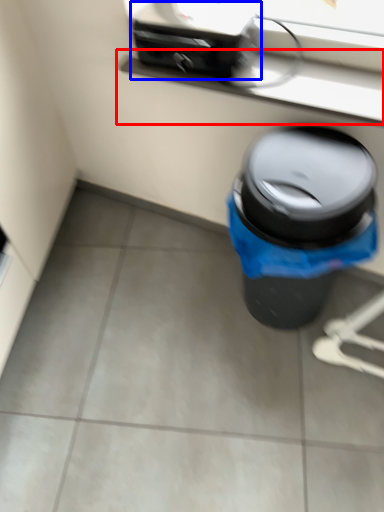
Question: Among these objects, which one is farthest to the camera, window sill (highlighted by a red box) or appliance (highlighted by a blue box)?

Choices:
 (A) window sill
 (B) appliance

Answer: (B)